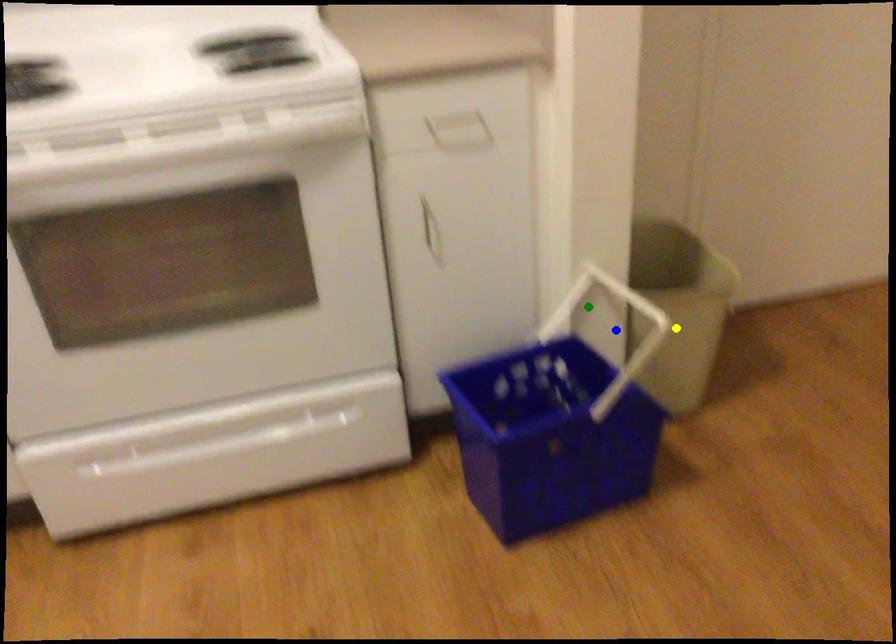
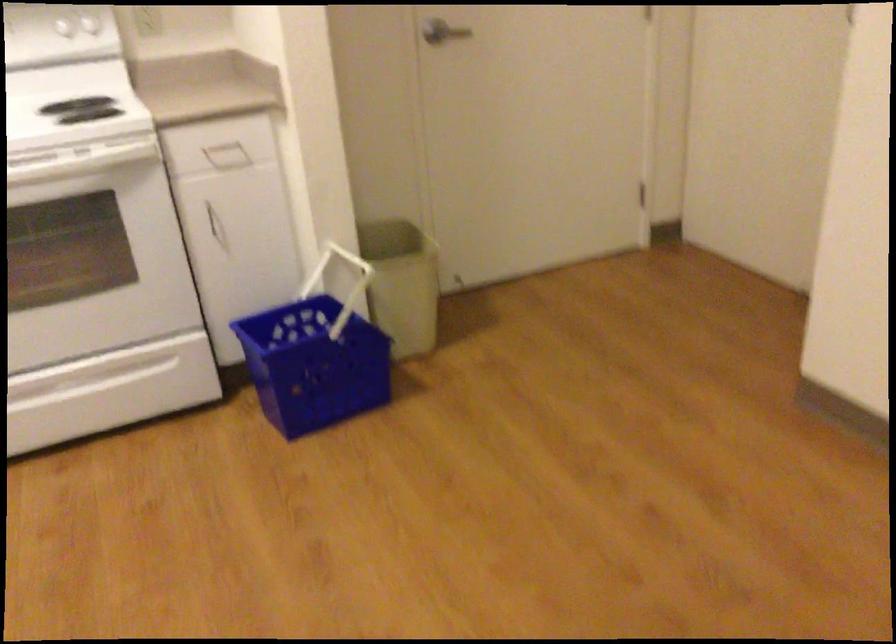
I am providing you with two images of the same scene from different viewpoints. Three points are marked in image1. Which point corresponds to a part or object that is occluded in image2?In image1, three points are marked. Which of them correspond to a part or object that is occluded in image2?Among the three points shown in image1, which one corresponds to a part or object that is no longer visible due to occlusion in image2?

blue point cannot be seen in image2.